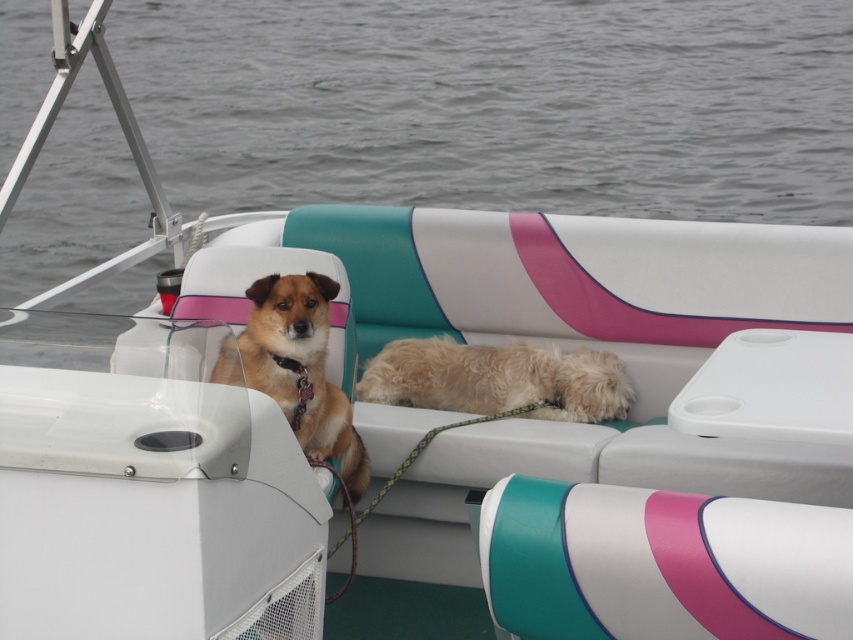
You are on a boat and want to know which dog is closer to you. The boat has a fuzzy beige dog at center and a brown furry dog at center. Which one is smaller?

The fuzzy beige dog at center is smaller than the brown furry dog at center.

You are a photographer on the boat and want to take a photo of both the fuzzy beige dog at center and the brown furry dog at center. Which dog should you focus on first if you want to capture the taller one in the frame?

The brown furry dog at center is taller than the fuzzy beige dog at center, so you should focus on the brown furry dog at center first to capture the taller one in the frame.